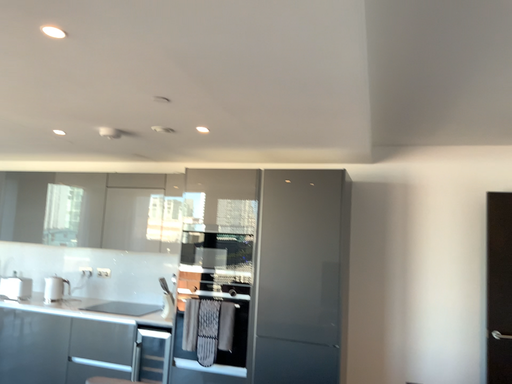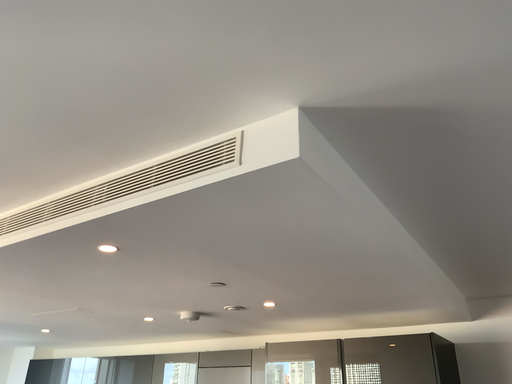
Question: How did the camera likely rotate when shooting the video?

Choices:
 (A) rotated right
 (B) rotated left

Answer: (B)